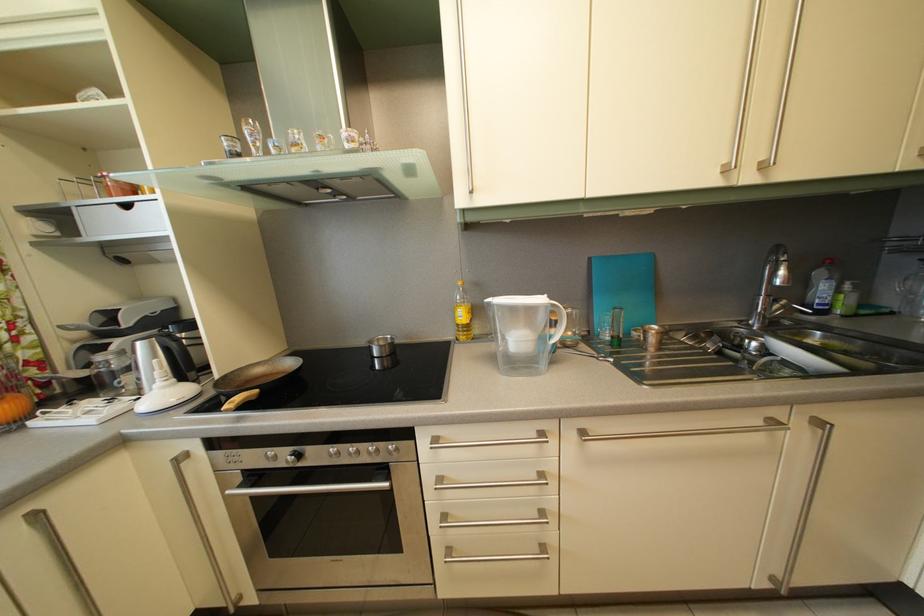
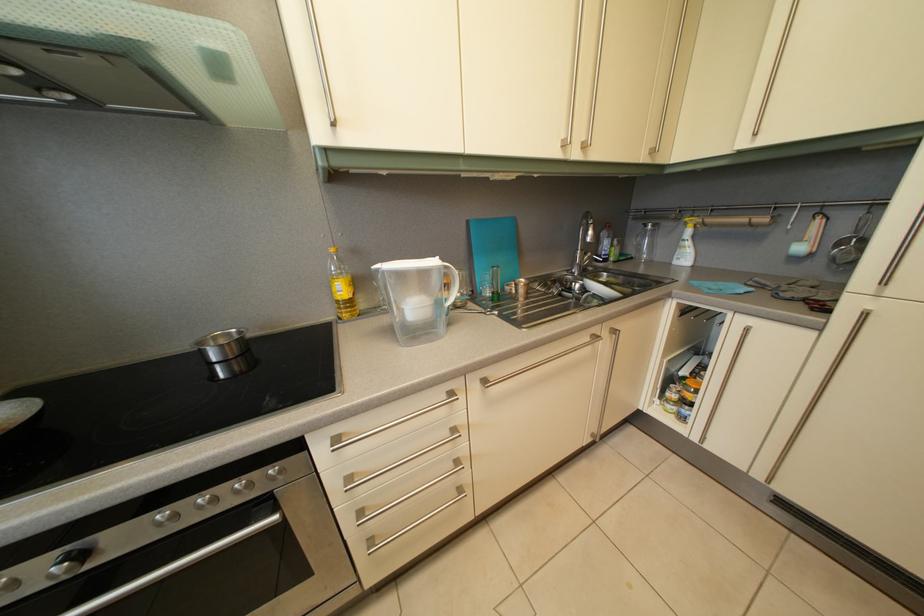
The point at (280,459) is marked in the first image. Where is the corresponding point in the second image?

(8, 586)